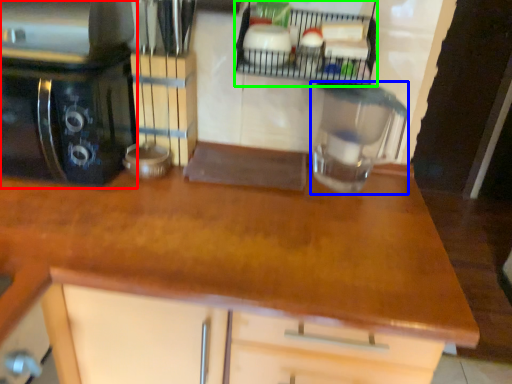
Question: Based on their relative distances, which object is farther from home appliance (highlighted by a red box)? Choose from kitchen appliance (highlighted by a blue box) and shelf (highlighted by a green box).

Choices:
 (A) kitchen appliance
 (B) shelf

Answer: (A)